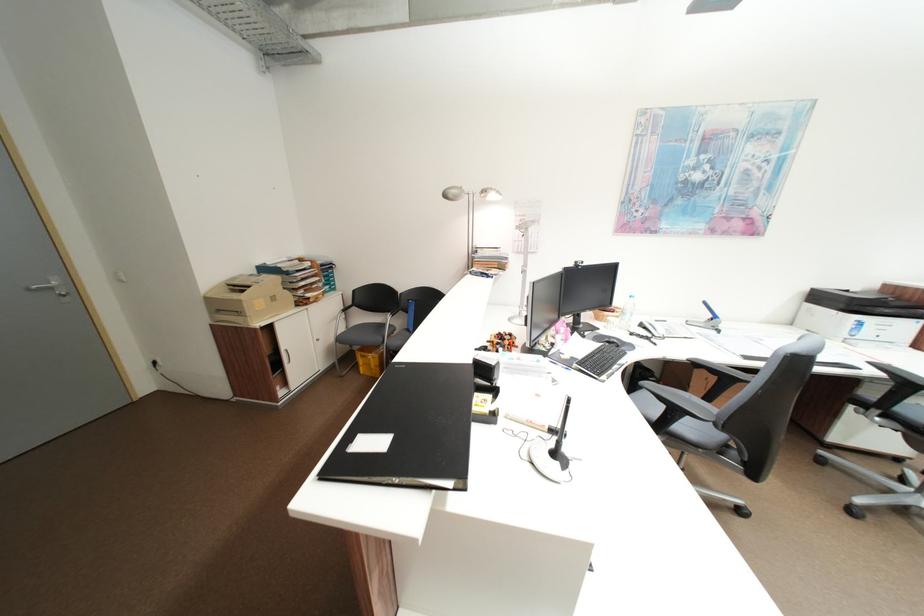
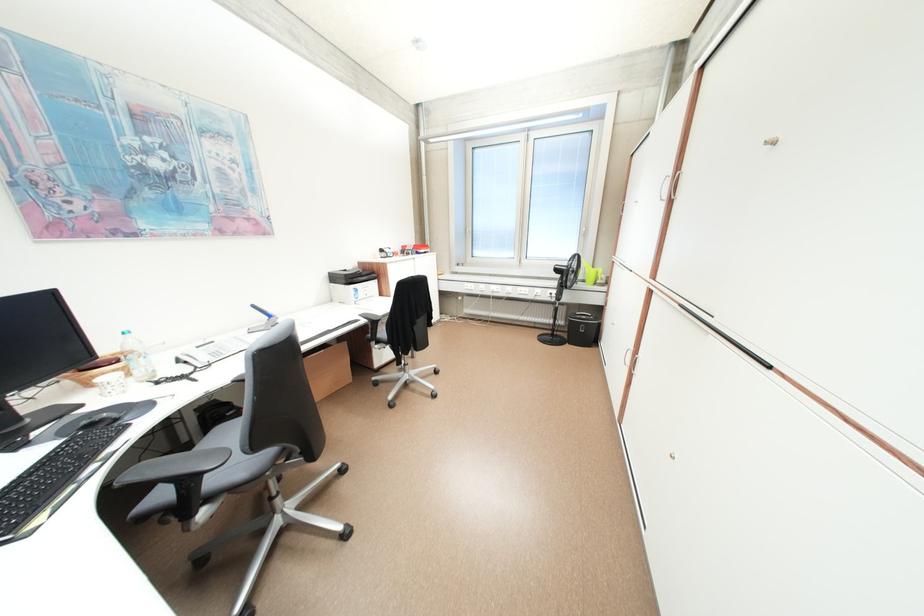
Where in the second image is the point corresponding to (618,342) from the first image?

(101, 426)